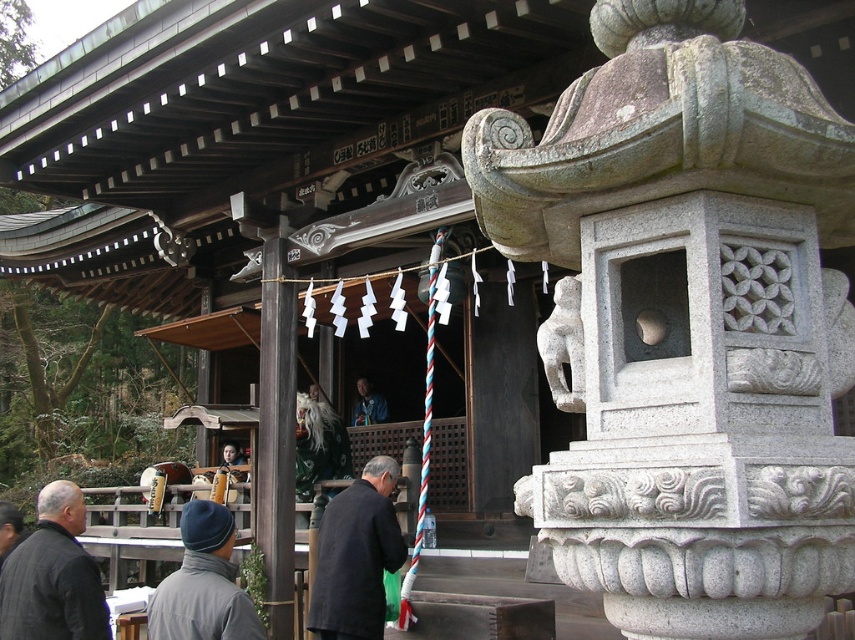
What do you see at coordinates (52, 576) in the screenshot? The height and width of the screenshot is (640, 855). I see `dark gray wool jacket at lower left` at bounding box center [52, 576].

What do you see at coordinates (52, 576) in the screenshot? The height and width of the screenshot is (640, 855). I see `dark gray wool jacket at lower left` at bounding box center [52, 576].

Where is `dark gray wool jacket at lower left`? The height and width of the screenshot is (640, 855). dark gray wool jacket at lower left is located at coordinates (52, 576).

Is dark gray coat at center in front of dark gray wool jacket at lower left?

No, it is not.

From the picture: Does dark gray coat at center have a smaller size compared to dark gray wool jacket at lower left?

Actually, dark gray coat at center might be larger than dark gray wool jacket at lower left.

Describe the element at coordinates (357, 556) in the screenshot. I see `dark gray coat at center` at that location.

The width and height of the screenshot is (855, 640). What are the coordinates of `dark gray coat at center` in the screenshot? It's located at (357, 556).

Is dark gray coat at center smaller than dark gray woolen hat at center?

No, dark gray coat at center is not smaller than dark gray woolen hat at center.

Is dark gray coat at center behind dark gray woolen hat at center?

Yes, it is behind dark gray woolen hat at center.

The width and height of the screenshot is (855, 640). Describe the element at coordinates (357, 556) in the screenshot. I see `dark gray coat at center` at that location.

What are the coordinates of `dark gray coat at center` in the screenshot? It's located at (357, 556).